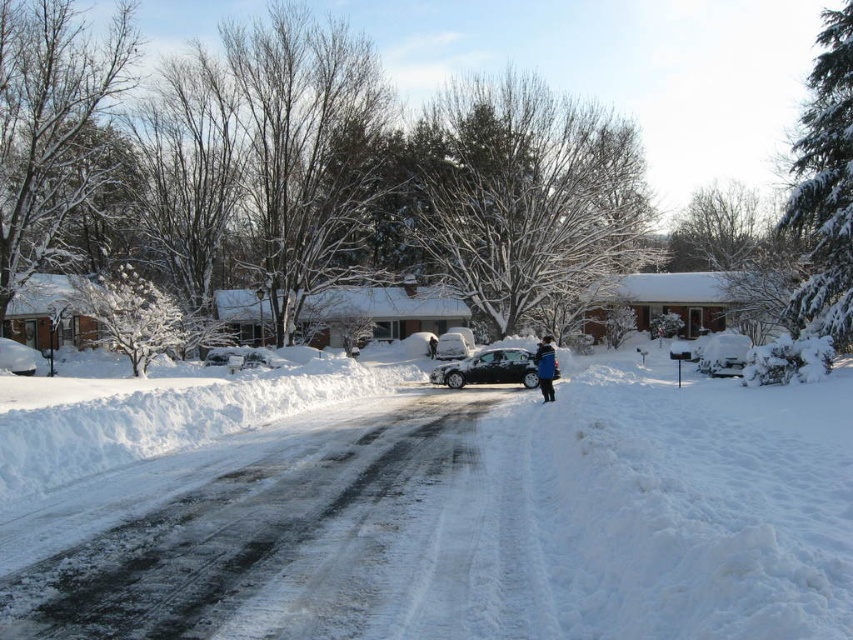
Does white fluffy snow at center have a smaller size compared to blue fleece jacket at center?

No.

Measure the distance between white fluffy snow at center and camera.

white fluffy snow at center and camera are 3.58 meters apart from each other.

Where is `white fluffy snow at center`? white fluffy snow at center is located at coordinates (459, 518).

Between black matte car at center and blue fleece jacket at center, which one is positioned higher?

blue fleece jacket at center is higher up.

The height and width of the screenshot is (640, 853). Describe the element at coordinates (490, 369) in the screenshot. I see `black matte car at center` at that location.

Who is more forward, (x=463, y=376) or (x=540, y=346)?

Point (x=540, y=346)

Where is `black matte car at center`? black matte car at center is located at coordinates (490, 369).

Describe the element at coordinates (459, 518) in the screenshot. Image resolution: width=853 pixels, height=640 pixels. I see `white fluffy snow at center` at that location.

Which is below, white fluffy snow at center or black matte car at center?

white fluffy snow at center is lower down.

Find the location of a particular element. This screenshot has height=640, width=853. white fluffy snow at center is located at coordinates (459, 518).